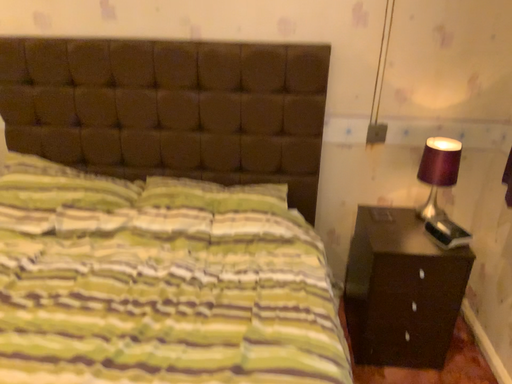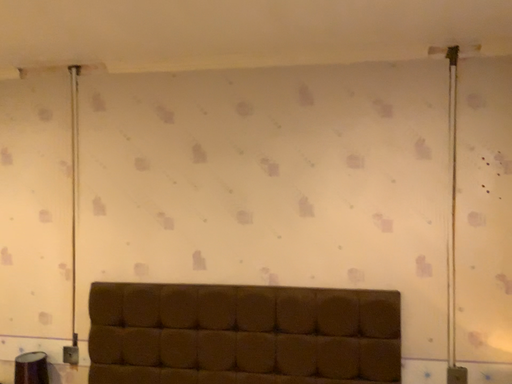
Question: Which way did the camera rotate in the video?

Choices:
 (A) rotated upward
 (B) rotated downward

Answer: (A)